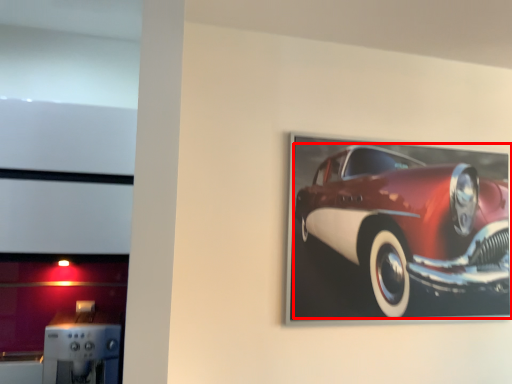
Question: From the image, what is the correct spatial relationship of car (annotated by the red box) in relation to appliance?

Choices:
 (A) left
 (B) right

Answer: (B)